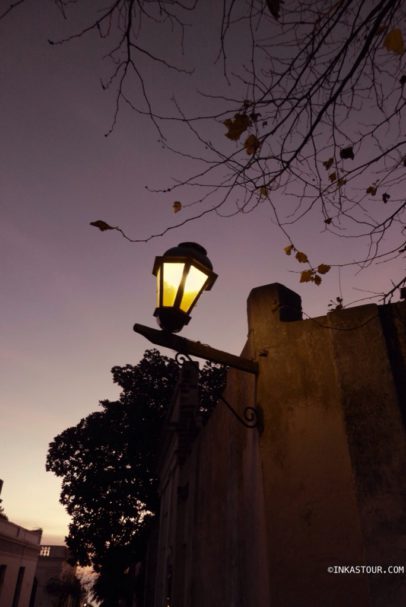
Locate an element on the screen. The width and height of the screenshot is (406, 607). the top of lamp is located at coordinates (189, 245).